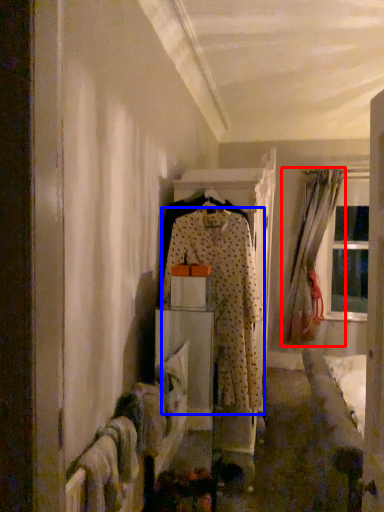
Question: Which object appears farthest to the camera in this image, curtain (highlighted by a red box) or fancy dress (highlighted by a blue box)?

Choices:
 (A) curtain
 (B) fancy dress

Answer: (A)